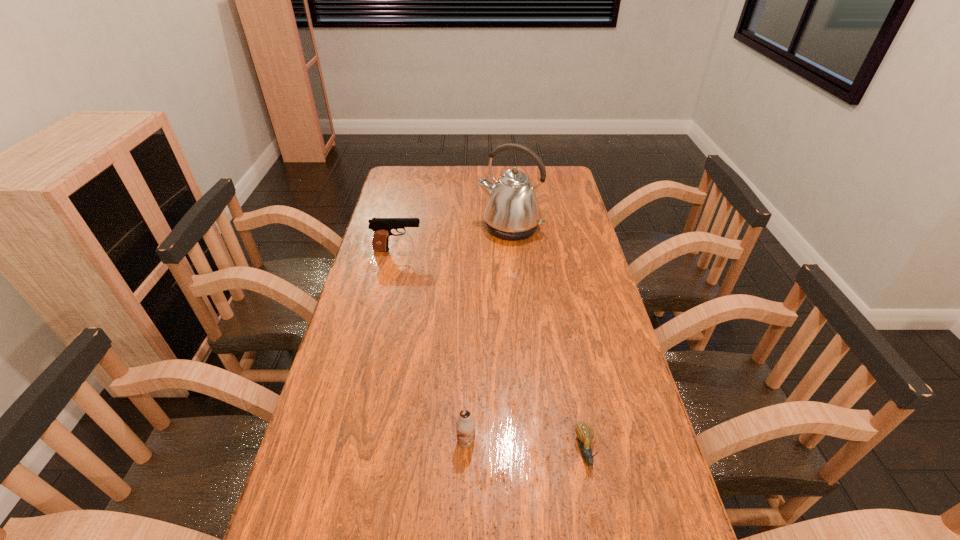
The width and height of the screenshot is (960, 540). Identify the location of free point that satisfies the following two spatial constraints: 1. at the barrel of the pistol; 2. on the left side of the chocolate milk. (354, 441).